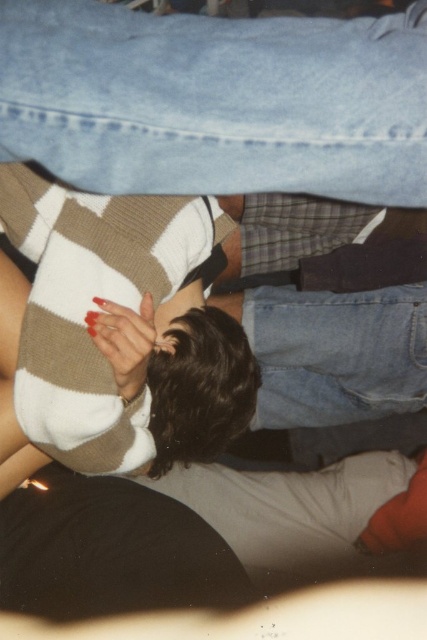
Where is `denim jeans at upper center`? The image size is (427, 640). denim jeans at upper center is located at coordinates click(216, 100).

Does point (295, 61) come in front of point (102, 328)?

That is True.

Who is more distant from viewer, (140, 138) or (113, 305)?

Point (113, 305)

At what (x,y) coordinates should I click in order to perform the action: click on denim jeans at upper center. Please return your answer as a coordinate pair (x, y). The image size is (427, 640). Looking at the image, I should click on (216, 100).